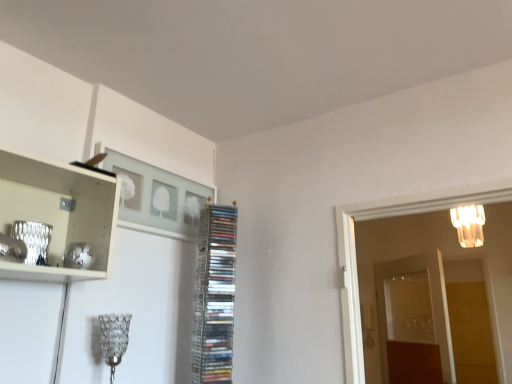
Question: Is clear plastic rack of cds at center taller or shorter than clear glass lampshade at lower left, the first lamp when ordered from front to back?

Choices:
 (A) tall
 (B) short

Answer: (A)

Question: Is point (226, 369) closer or farther from the camera than point (101, 339)?

Choices:
 (A) closer
 (B) farther

Answer: (B)

Question: Which object is the closest to the transparent glass door at right, placed as the first glass door when sorted from right to left?

Choices:
 (A) transparent glass door at right, acting as the 2th glass door starting from the right
 (B) translucent glass chandelier at upper right, which ranks as the 2th lamp in bottom-to-top order
 (C) clear glass lampshade at lower left, which is counted as the 2th lamp, starting from the right
 (D) matte gray picture frame at upper center
 (E) clear plastic rack of cds at center

Answer: (E)

Question: Which object is positioned farthest from the clear glass lampshade at lower left, the first lamp when ordered from front to back?

Choices:
 (A) clear plastic rack of cds at center
 (B) matte gray picture frame at upper center
 (C) translucent glass chandelier at upper right, the 1th lamp from the back
 (D) transparent glass door at right, placed as the first glass door when sorted from right to left
 (E) transparent glass door at right, which is the 1th glass door from left to right

Answer: (E)